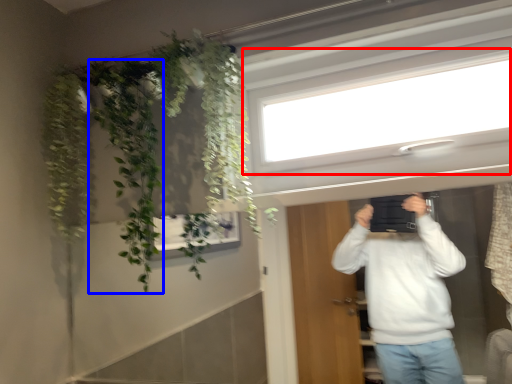
Question: Which point is further to the camera, window (highlighted by a red box) or plant (highlighted by a blue box)?

Choices:
 (A) window
 (B) plant

Answer: (B)